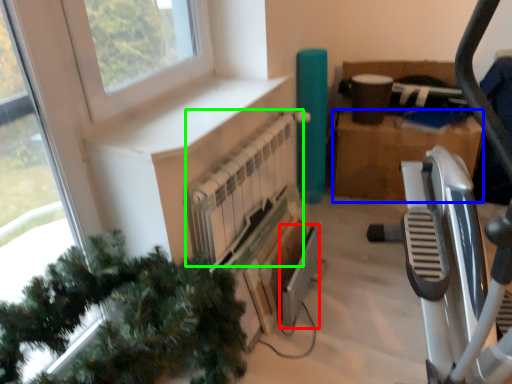
Question: Based on their relative distances, which object is farther from appliance (highlighted by a red box)? Choose from cardboard box (highlighted by a blue box) and radiator (highlighted by a green box).

Choices:
 (A) cardboard box
 (B) radiator

Answer: (A)